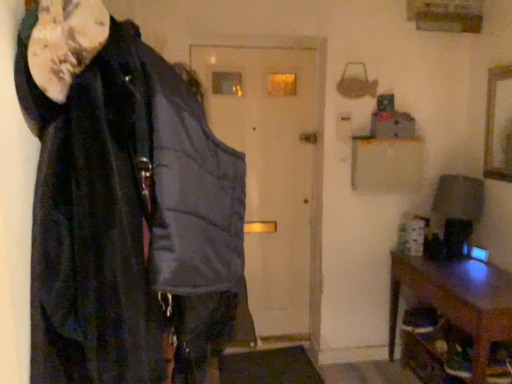
Question: Does wooden picture frame at upper right have a lesser width compared to brown wooden table at lower right?

Choices:
 (A) yes
 (B) no

Answer: (A)

Question: Is wooden picture frame at upper right not inside brown wooden table at lower right?

Choices:
 (A) yes
 (B) no

Answer: (A)

Question: Considering the relative sizes of wooden picture frame at upper right and brown wooden table at lower right in the image provided, is wooden picture frame at upper right shorter than brown wooden table at lower right?

Choices:
 (A) yes
 (B) no

Answer: (A)

Question: Is the depth of wooden picture frame at upper right less than that of brown wooden table at lower right?

Choices:
 (A) no
 (B) yes

Answer: (A)

Question: Is wooden picture frame at upper right turned away from brown wooden table at lower right?

Choices:
 (A) yes
 (B) no

Answer: (B)

Question: Is velvet black cloak at left bigger or smaller than wooden picture frame at upper right?

Choices:
 (A) small
 (B) big

Answer: (B)

Question: From their relative heights in the image, would you say velvet black cloak at left is taller or shorter than wooden picture frame at upper right?

Choices:
 (A) tall
 (B) short

Answer: (A)

Question: Would you say velvet black cloak at left is to the left or to the right of wooden picture frame at upper right in the picture?

Choices:
 (A) left
 (B) right

Answer: (A)

Question: Is point (162, 355) closer or farther from the camera than point (484, 160)?

Choices:
 (A) closer
 (B) farther

Answer: (A)

Question: Is brown wooden table at lower right in front of or behind wooden picture frame at upper right in the image?

Choices:
 (A) front
 (B) behind

Answer: (A)

Question: From the image's perspective, relative to wooden picture frame at upper right, is brown wooden table at lower right above or below?

Choices:
 (A) above
 (B) below

Answer: (B)

Question: From a real-world perspective, is brown wooden table at lower right positioned above or below wooden picture frame at upper right?

Choices:
 (A) below
 (B) above

Answer: (A)

Question: From their relative heights in the image, would you say brown wooden table at lower right is taller or shorter than wooden picture frame at upper right?

Choices:
 (A) short
 (B) tall

Answer: (B)

Question: Considering the positions of matte gray vest at center and velvet black cloak at left in the image, is matte gray vest at center bigger or smaller than velvet black cloak at left?

Choices:
 (A) big
 (B) small

Answer: (B)

Question: Is point (302, 200) positioned closer to the camera than point (46, 281)?

Choices:
 (A) closer
 (B) farther

Answer: (B)